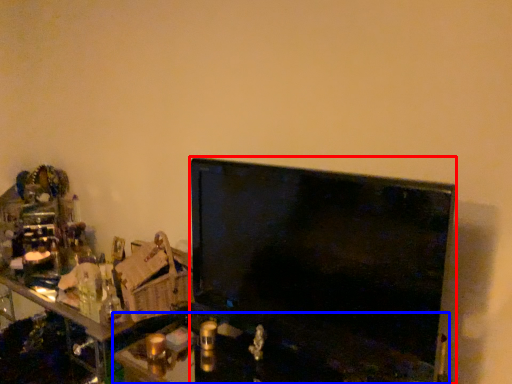
Question: Which object is further to the camera taking this photo, television (highlighted by a red box) or computer (highlighted by a blue box)?

Choices:
 (A) television
 (B) computer

Answer: (A)